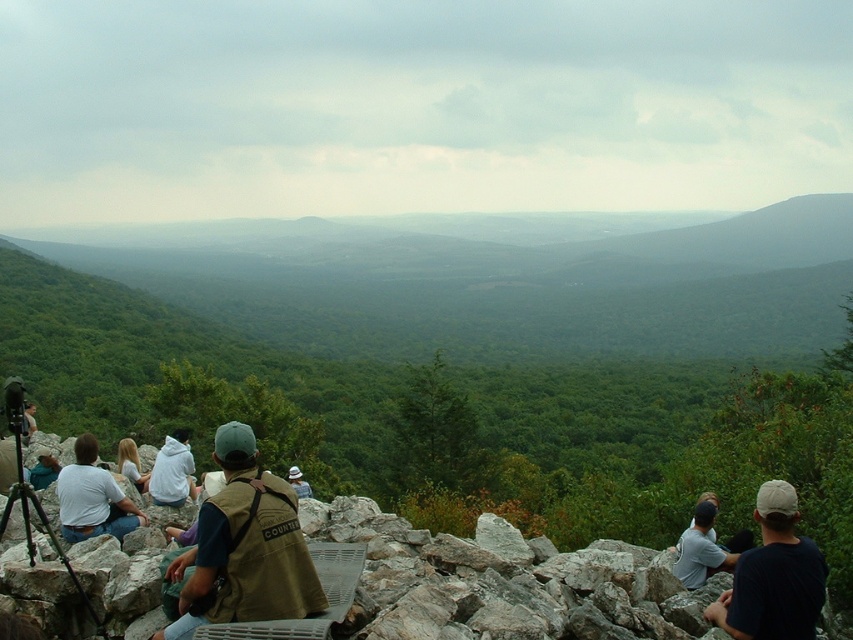
Which is below, dark blue t-shirt at lower right or white cotton shirt at lower left?

Positioned lower is white cotton shirt at lower left.

Between point (775, 509) and point (68, 502), which one is positioned behind?

Point (68, 502)

The image size is (853, 640). In order to click on dark blue t-shirt at lower right in this screenshot , I will do `click(773, 576)`.

Find the location of a particular element. dark blue t-shirt at lower right is located at coordinates (773, 576).

Who is lower down, light gray t-shirt at center right or black matte tripod at lower left?

Positioned lower is light gray t-shirt at center right.

Between point (704, 529) and point (106, 632), which one is positioned behind?

Point (704, 529)

Identify the location of light gray t-shirt at center right. The width and height of the screenshot is (853, 640). (700, 548).

Does gray rock at lower left have a greater width compared to brown canvas vest at center?

No.

Identify the location of gray rock at lower left. (430, 573).